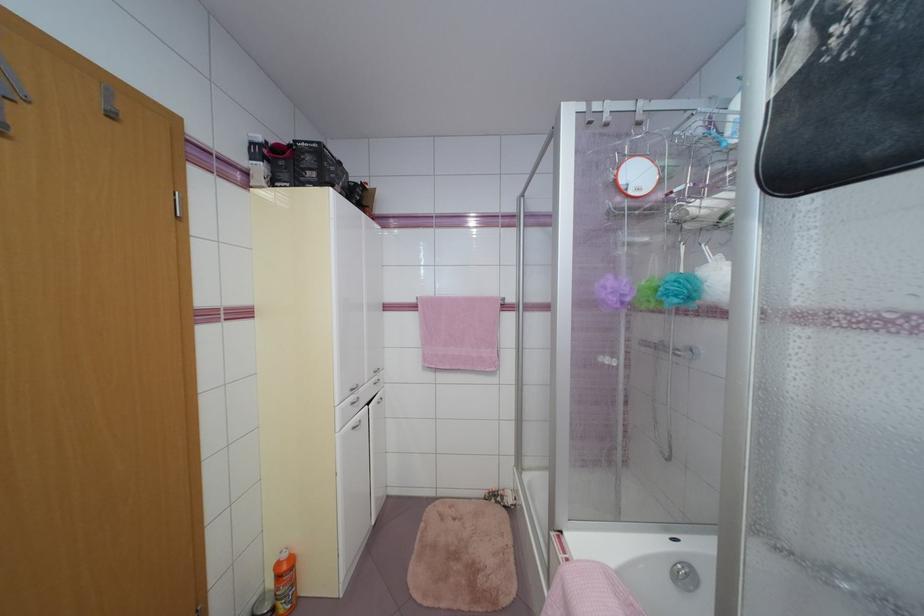
Find where to pull the shower door handle. Please return your answer as a coordinate pair (x, y).

(671, 349)